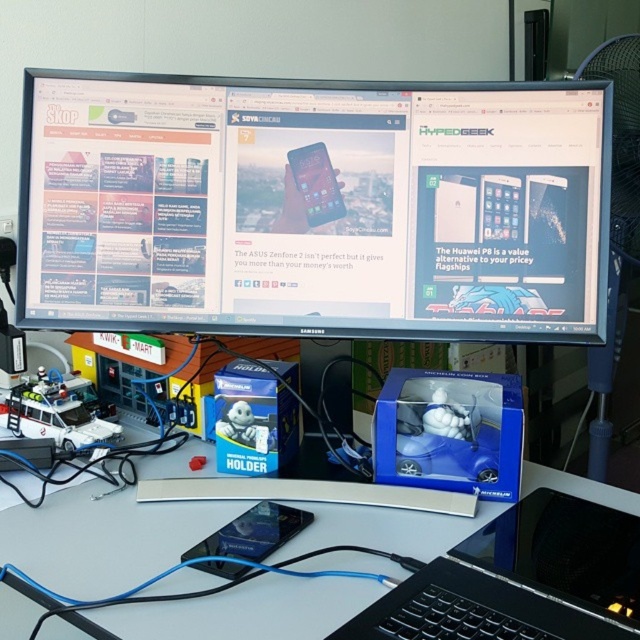
Question: Is black glossy monitor at upper center thinner than white plastic table at center?

Choices:
 (A) yes
 (B) no

Answer: (A)

Question: Which object is closer to the camera taking this photo?

Choices:
 (A) black plastic laptop at lower right
 (B) white plastic table at center
 (C) black glossy monitor at upper center

Answer: (A)

Question: Can you confirm if black glossy monitor at upper center is positioned to the left of black plastic laptop at lower right?

Choices:
 (A) no
 (B) yes

Answer: (B)

Question: Which point appears farthest from the camera in this image?

Choices:
 (A) (474, 557)
 (B) (93, 134)
 (C) (333, 618)

Answer: (B)

Question: Which object is the farthest from the black plastic laptop at lower right?

Choices:
 (A) black glossy monitor at upper center
 (B) white plastic table at center

Answer: (A)

Question: Can you confirm if black glossy monitor at upper center is positioned above black plastic laptop at lower right?

Choices:
 (A) yes
 (B) no

Answer: (A)